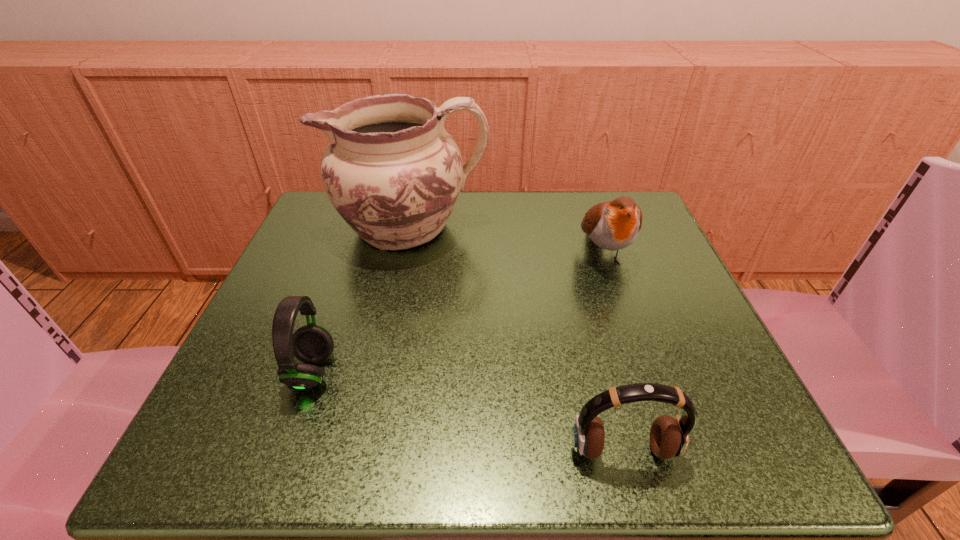
Where is `the tallest object`? This screenshot has height=540, width=960. the tallest object is located at coordinates (393, 173).

Locate an element on the screen. This screenshot has height=540, width=960. bird is located at coordinates (613, 225).

Where is `the left headset`? This screenshot has height=540, width=960. the left headset is located at coordinates (312, 344).

Locate an element on the screen. The height and width of the screenshot is (540, 960). the farther headset is located at coordinates (312, 344).

Find the location of a particular element. This screenshot has width=960, height=540. the nearer headset is located at coordinates (669, 437).

This screenshot has height=540, width=960. I want to click on the right headset, so click(x=669, y=437).

Locate an element on the screen. vacant area situated 0.240m at the face of the bird is located at coordinates (653, 399).

Where is `free space located on the ear cups of the second nearest object`? Image resolution: width=960 pixels, height=540 pixels. free space located on the ear cups of the second nearest object is located at coordinates [x=467, y=372].

Where is `pitcher that is at the far edge`? pitcher that is at the far edge is located at coordinates (393, 173).

Identify the location of bird that is at the far edge. (613, 225).